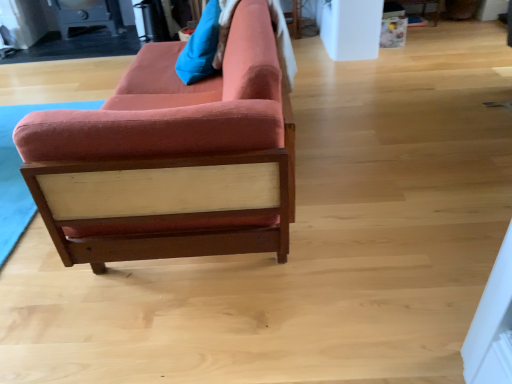
Question: Is velvet red couch at left to the right of blue fabric pillow at upper center from the viewer's perspective?

Choices:
 (A) yes
 (B) no

Answer: (A)

Question: Can you confirm if velvet red couch at left is wider than blue fabric pillow at upper center?

Choices:
 (A) no
 (B) yes

Answer: (B)

Question: Could you tell me if velvet red couch at left is turned towards blue fabric pillow at upper center?

Choices:
 (A) no
 (B) yes

Answer: (B)

Question: From the image's perspective, is velvet red couch at left on top of blue fabric pillow at upper center?

Choices:
 (A) yes
 (B) no

Answer: (B)

Question: Is velvet red couch at left bigger than blue fabric pillow at upper center?

Choices:
 (A) no
 (B) yes

Answer: (B)

Question: From a real-world perspective, is velvet red couch at left under blue fabric pillow at upper center?

Choices:
 (A) yes
 (B) no

Answer: (A)

Question: Could you tell me if blue fabric pillow at upper center is facing velvet red couch at left?

Choices:
 (A) no
 (B) yes

Answer: (B)

Question: From a real-world perspective, is blue fabric pillow at upper center positioned under velvet red couch at left based on gravity?

Choices:
 (A) no
 (B) yes

Answer: (A)

Question: Is blue fabric pillow at upper center shorter than velvet red couch at left?

Choices:
 (A) yes
 (B) no

Answer: (A)

Question: Is blue fabric pillow at upper center touching velvet red couch at left?

Choices:
 (A) yes
 (B) no

Answer: (B)

Question: Considering the relative sizes of blue fabric pillow at upper center and velvet red couch at left in the image provided, is blue fabric pillow at upper center taller than velvet red couch at left?

Choices:
 (A) yes
 (B) no

Answer: (B)

Question: Considering the relative sizes of blue fabric pillow at upper center and velvet red couch at left in the image provided, is blue fabric pillow at upper center wider than velvet red couch at left?

Choices:
 (A) no
 (B) yes

Answer: (A)

Question: Does point (206, 49) appear closer or farther from the camera than point (224, 253)?

Choices:
 (A) farther
 (B) closer

Answer: (A)